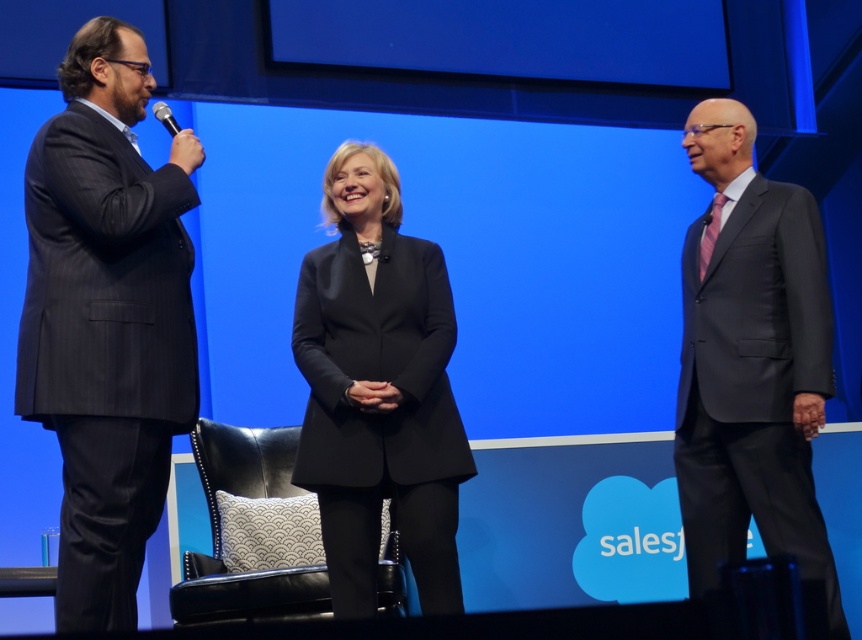
Who is lower down, dark gray pinstripe suit at left or black leather chair at center?

black leather chair at center

Image resolution: width=862 pixels, height=640 pixels. I want to click on dark gray pinstripe suit at left, so click(x=105, y=317).

Which is behind, point (228, 589) or point (166, 108)?

The point (228, 589) is more distant.

This screenshot has width=862, height=640. Describe the element at coordinates (253, 532) in the screenshot. I see `black leather chair at center` at that location.

Is point (191, 570) more distant than point (158, 113)?

Yes, it is.

At what (x,y) coordinates should I click in order to perform the action: click on black leather chair at center. Please return your answer as a coordinate pair (x, y). The height and width of the screenshot is (640, 862). Looking at the image, I should click on (253, 532).

Is dark gray pinstripe suit at left bigger than dark gray suit at right?

No.

Is point (82, 102) farther from camera compared to point (748, 444)?

No, (82, 102) is in front of (748, 444).

This screenshot has height=640, width=862. I want to click on dark gray pinstripe suit at left, so click(105, 317).